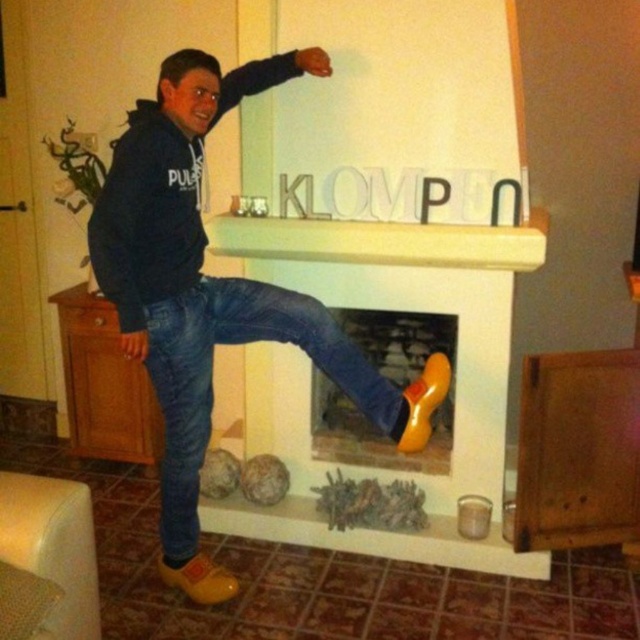
Is yellow leather clogs at center thinner than jeans at center?

In fact, yellow leather clogs at center might be wider than jeans at center.

Between yellow leather clogs at center and jeans at center, which one is positioned lower?

jeans at center is below.

The width and height of the screenshot is (640, 640). In order to click on yellow leather clogs at center in this screenshot , I will do `click(212, 294)`.

The image size is (640, 640). I want to click on yellow leather clogs at center, so click(212, 294).